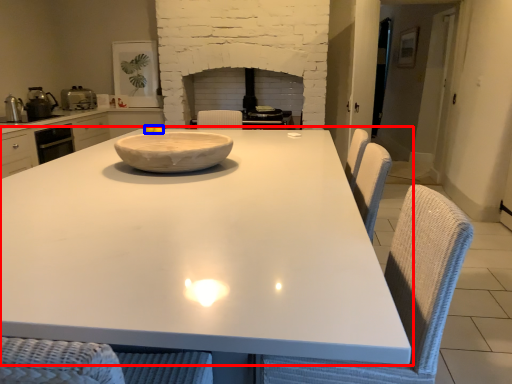
Question: Which object appears closest to the camera in this image, table (highlighted by a red box) or food (highlighted by a blue box)?

Choices:
 (A) table
 (B) food

Answer: (A)